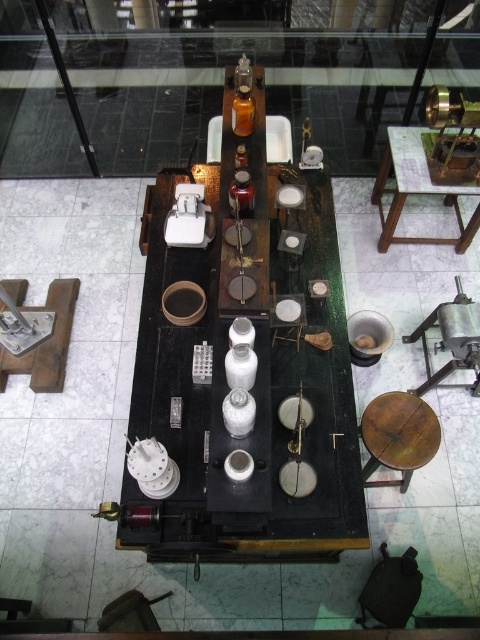
You are a museum visitor who wants to place a heavy artifact on the wooden table at upper right and the wooden stool at lower right. Which surface can support the weight better?

The wooden table at upper right is taller than the wooden stool at lower right, but height does not indicate weight capacity. Both objects are made of wood, so their weight capacity depends on their construction and materials. Without specific information on their sturdiness, it is impossible to determine which can support the weight better.

You are a museum curator examining the display. You need to place a new artifact between the wooden table at center and the wooden table at upper right. Based on their positions, where should you position the artifact?

Since the wooden table at center is to the left of the wooden table at upper right, you should place the new artifact between them, positioning it to the right of the wooden table at center and to the left of the wooden table at upper right.

You are a museum curator arranging an exhibit. You have two wooden tables available for display. The wooden table at center and the wooden table at upper right. Which table should you choose if you need a larger surface area to place multiple scientific instruments?

The wooden table at center is larger in size than the wooden table at upper right, so you should choose the wooden table at center for a larger surface area to place multiple scientific instruments.